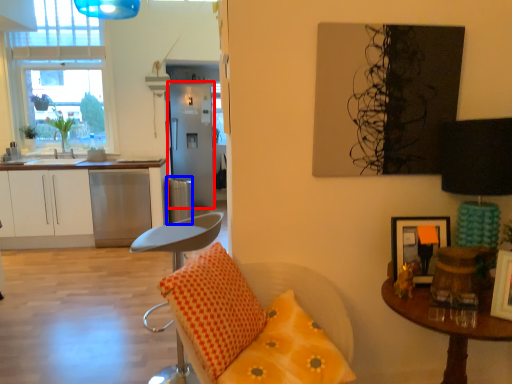
Question: Which object is closer to the camera taking this photo, fridge (highlighted by a red box) or trash bin/can (highlighted by a blue box)?

Choices:
 (A) fridge
 (B) trash bin/can

Answer: (B)